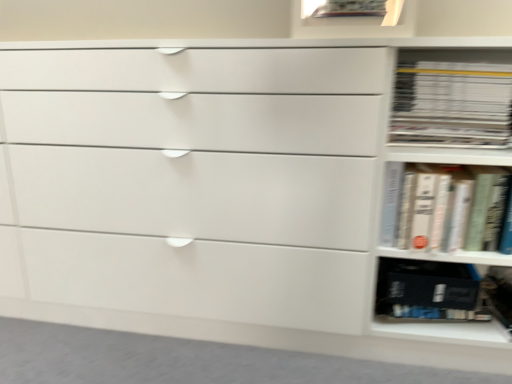
I want to click on white matte book at right, acting as the first book starting from the bottom, so click(x=443, y=207).

What is the approximate width of white glossy book at right, which is counted as the first book, starting from the top?

white glossy book at right, which is counted as the first book, starting from the top, is 8.91 inches in width.

Where is `black matte book at lower right`? The height and width of the screenshot is (384, 512). black matte book at lower right is located at coordinates tap(428, 290).

Image resolution: width=512 pixels, height=384 pixels. I want to click on the 2nd book in front of the black matte book at lower right, so click(443, 207).

Looking at this image, which object is positioned more to the left, white matte book at right, acting as the first book starting from the bottom, or black matte book at lower right?

black matte book at lower right is more to the left.

Is white matte book at right, acting as the first book starting from the bottom, in contact with black matte book at lower right?

No, white matte book at right, acting as the first book starting from the bottom, is not making contact with black matte book at lower right.

Which point is more distant from viewer, (411, 170) or (413, 302)?

Point (413, 302)

Between point (432, 310) and point (494, 144), which one is positioned behind?

Point (432, 310)

From the image's perspective, count 2nd books upward from the black matte book at lower right and point to it. Please provide its 2D coordinates.

[(452, 104)]

From the image's perspective, does black matte book at lower right appear higher than white glossy book at right, which is the 2th book from bottom to top?

No, from the image's perspective, black matte book at lower right is not above white glossy book at right, which is the 2th book from bottom to top.

Does black matte book at lower right have a greater width compared to white glossy book at right, which is counted as the first book, starting from the top?

No, black matte book at lower right is not wider than white glossy book at right, which is counted as the first book, starting from the top.

Is white glossy book at right, which is counted as the first book, starting from the top, oriented towards white matte book at right, placed as the 2th book when sorted from top to bottom?

No, white glossy book at right, which is counted as the first book, starting from the top, is not oriented towards white matte book at right, placed as the 2th book when sorted from top to bottom.

From a real-world perspective, is white glossy book at right, which is the 2th book from bottom to top, positioned over white matte book at right, acting as the first book starting from the bottom, based on gravity?

Yes, from a real-world perspective, white glossy book at right, which is the 2th book from bottom to top, is above white matte book at right, acting as the first book starting from the bottom.

How different are the orientations of white glossy book at right, which is the 2th book from bottom to top, and white matte book at right, acting as the first book starting from the bottom, in degrees?

0.823 degrees separate the facing orientations of white glossy book at right, which is the 2th book from bottom to top, and white matte book at right, acting as the first book starting from the bottom.

Which object is positioned more to the right, white glossy book at right, which is counted as the first book, starting from the top, or white matte book at right, acting as the first book starting from the bottom?

white matte book at right, acting as the first book starting from the bottom, is more to the right.

Does white matte book at right, placed as the 2th book when sorted from top to bottom, appear on the left side of white glossy book at right, which is the 2th book from bottom to top?

Incorrect, white matte book at right, placed as the 2th book when sorted from top to bottom, is not on the left side of white glossy book at right, which is the 2th book from bottom to top.

Is white matte book at right, acting as the first book starting from the bottom, far from white glossy book at right, which is counted as the first book, starting from the top?

No.

In the image, there is a white glossy book at right, which is counted as the first book, starting from the top. Identify the location of book below it (from a real-world perspective). This screenshot has width=512, height=384. (443, 207).

Considering the sizes of white glossy book at right, which is counted as the first book, starting from the top, and black matte book at lower right in the image, is white glossy book at right, which is counted as the first book, starting from the top, taller or shorter than black matte book at lower right?

Clearly, white glossy book at right, which is counted as the first book, starting from the top, is taller compared to black matte book at lower right.

Is point (417, 66) farther from camera compared to point (450, 304)?

No, it is in front of (450, 304).

Is black matte book at lower right surrounded by white glossy book at right, which is the 2th book from bottom to top?

No.

Would you say white matte book at right, placed as the 2th book when sorted from top to bottom, is part of black matte book at lower right's contents?

No, white matte book at right, placed as the 2th book when sorted from top to bottom, is not inside black matte book at lower right.

Is black matte book at lower right far away from white matte book at right, acting as the first book starting from the bottom?

No.

From a real-world perspective, is black matte book at lower right physically located above or below white matte book at right, placed as the 2th book when sorted from top to bottom?

black matte book at lower right is below white matte book at right, placed as the 2th book when sorted from top to bottom.

Who is taller, black matte book at lower right or white matte book at right, acting as the first book starting from the bottom?

white matte book at right, acting as the first book starting from the bottom, is taller.

Identify the location of paperback book that is on the left side of white matte book at right, placed as the 2th book when sorted from top to bottom. (428, 290).

At what (x,y) coordinates should I click in order to perform the action: click on paperback book below the white glossy book at right, which is the 2th book from bottom to top (from a real-world perspective). Please return your answer as a coordinate pair (x, y). Looking at the image, I should click on (428, 290).

Consider the image. Looking at the image, which one is located further to black matte book at lower right, white glossy book at right, which is the 2th book from bottom to top, or white matte book at right, placed as the 2th book when sorted from top to bottom?

white glossy book at right, which is the 2th book from bottom to top, is positioned further to the anchor black matte book at lower right.

Estimate the real-world distances between objects in this image. Which object is closer to white matte book at right, placed as the 2th book when sorted from top to bottom, black matte book at lower right or white glossy book at right, which is counted as the first book, starting from the top?

white glossy book at right, which is counted as the first book, starting from the top, is positioned closer to the anchor white matte book at right, placed as the 2th book when sorted from top to bottom.

Looking at the image, which one is located further to white glossy book at right, which is the 2th book from bottom to top, black matte book at lower right or white matte book at right, acting as the first book starting from the bottom?

black matte book at lower right is further to white glossy book at right, which is the 2th book from bottom to top.

Considering their positions, is white glossy book at right, which is the 2th book from bottom to top, positioned closer to white matte book at right, acting as the first book starting from the bottom, than black matte book at lower right?

white glossy book at right, which is the 2th book from bottom to top, is closer to white matte book at right, acting as the first book starting from the bottom.

Looking at the image, which one is located closer to black matte book at lower right, white matte book at right, placed as the 2th book when sorted from top to bottom, or white glossy book at right, which is counted as the first book, starting from the top?

white matte book at right, placed as the 2th book when sorted from top to bottom, is positioned closer to the anchor black matte book at lower right.

From the image, which object appears to be farther from white glossy book at right, which is counted as the first book, starting from the top, white matte book at right, placed as the 2th book when sorted from top to bottom, or black matte book at lower right?

black matte book at lower right is positioned further to the anchor white glossy book at right, which is counted as the first book, starting from the top.

Locate an element on the screen. The width and height of the screenshot is (512, 384). book between white glossy book at right, which is the 2th book from bottom to top, and black matte book at lower right in the up-down direction is located at coordinates (443, 207).